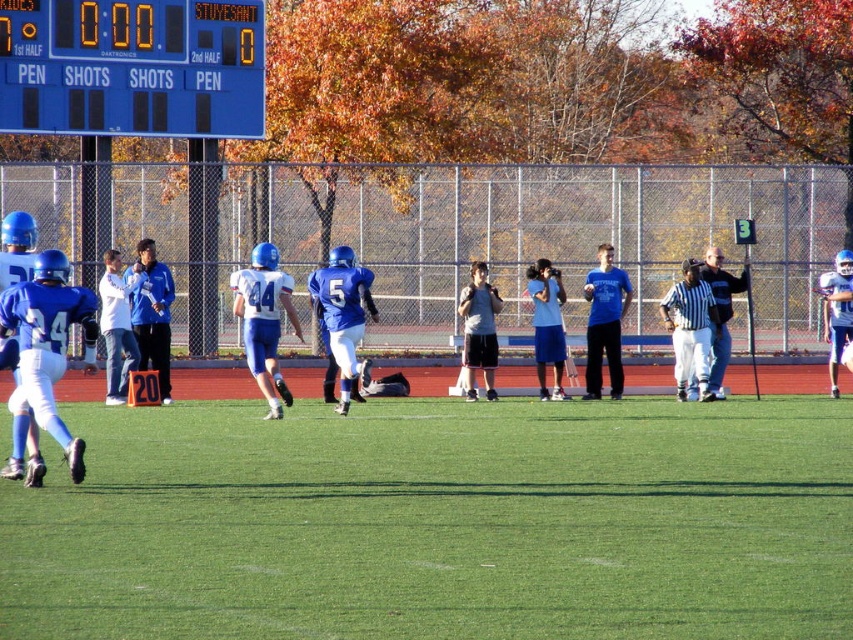
Between green grass at center and blue plastic scoreboard at upper left, which one is positioned lower?

Positioned lower is green grass at center.

Does green grass at center appear over blue plastic scoreboard at upper left?

No.

The image size is (853, 640). What do you see at coordinates (440, 522) in the screenshot?
I see `green grass at center` at bounding box center [440, 522].

This screenshot has width=853, height=640. Identify the location of green grass at center. (440, 522).